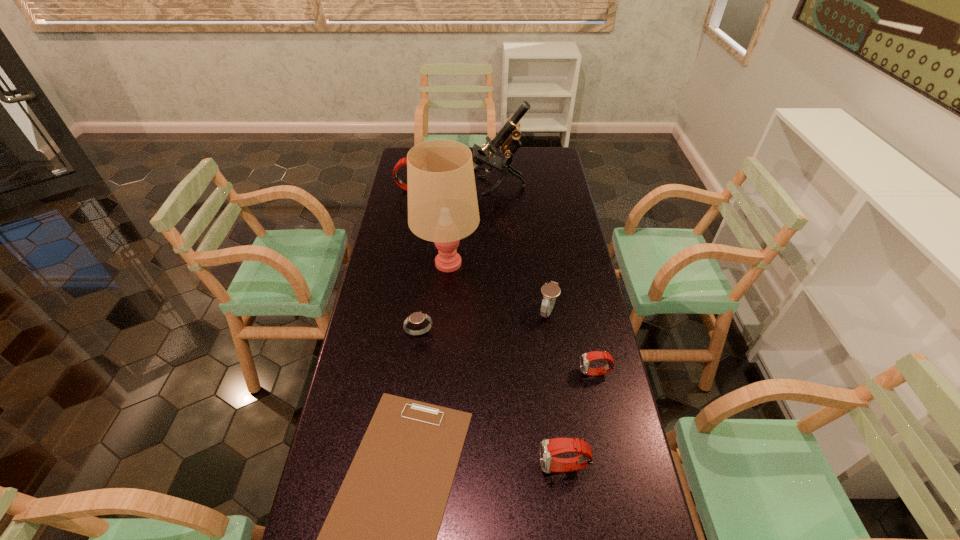
This screenshot has height=540, width=960. In order to click on free location located on the face of the second smallest red watch in this screenshot , I will do `click(431, 467)`.

Locate an element on the screen. The height and width of the screenshot is (540, 960). vacant space located on the back of the bigger gray watch is located at coordinates (540, 254).

Locate an element on the screen. vacant space situated on the face of the third nearest object is located at coordinates [536, 373].

Where is `free spot located 0.280m on the face of the third nearest object`? The image size is (960, 540). free spot located 0.280m on the face of the third nearest object is located at coordinates (485, 373).

The height and width of the screenshot is (540, 960). I want to click on vacant space located 0.360m on the face of the third nearest object, so click(x=457, y=373).

Locate an element on the screen. The width and height of the screenshot is (960, 540). vacant region located on the front of the left gray watch is located at coordinates (405, 453).

At what (x,y) coordinates should I click in order to perform the action: click on lampshade located in the left edge section of the desktop. Please return your answer as a coordinate pair (x, y). The width and height of the screenshot is (960, 540). Looking at the image, I should click on (442, 200).

Where is `vacant space at the left edge of the desktop`? vacant space at the left edge of the desktop is located at coordinates (370, 350).

You are a GUI agent. You are given a task and a screenshot of the screen. Output one action in this format:
    pyautogui.click(x=<x>, y=<y>)
    Task: Click on the free space at the right edge
    
    Given the screenshot: What is the action you would take?
    pyautogui.click(x=586, y=349)

This screenshot has width=960, height=540. I want to click on free point between the tallest watch and the nearest watch, so 488,328.